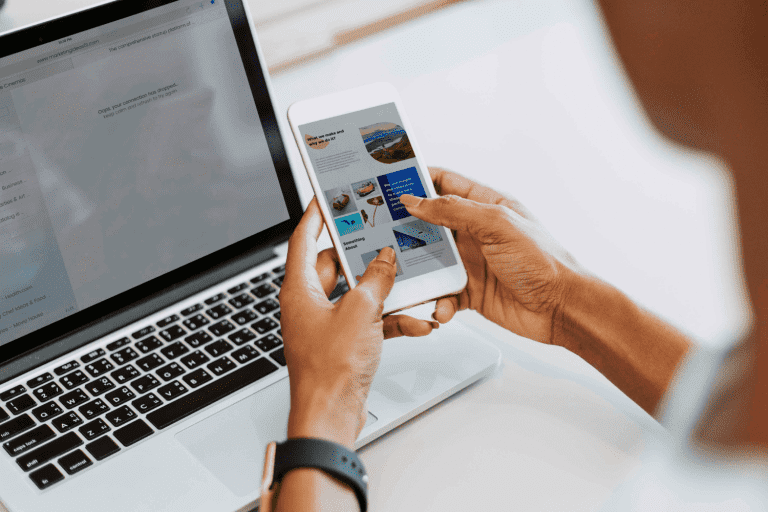
Where is `laptop`? This screenshot has width=768, height=512. laptop is located at coordinates (104, 492).